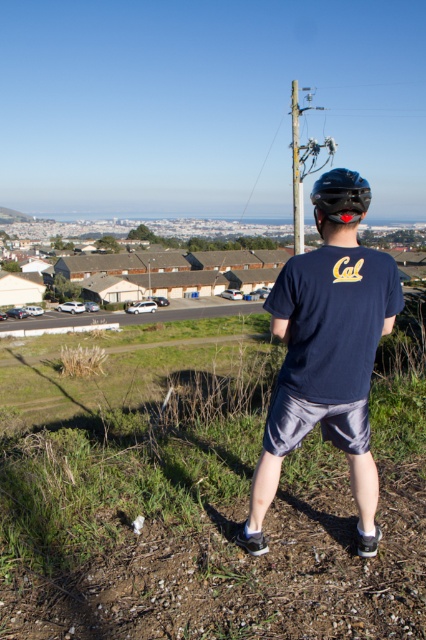
You are standing at the point labeled point (365, 189) and want to walk to the point labeled point (370, 355). Given that both points are on the same path, which direction should you face to move towards your destination?

Since point (370, 355) is behind point (365, 189), you should face away from the horizon to reach your destination.

You are a hiker who wants to place a 2 foot wide tent on the ground between the brown dirt track at lower center and the black matte helmet at center. Is there enough space for the tent?

The brown dirt track at lower center is 6.69 feet from the black matte helmet at center. Since the tent is only 2 feet wide, there is sufficient space between them to place the tent.